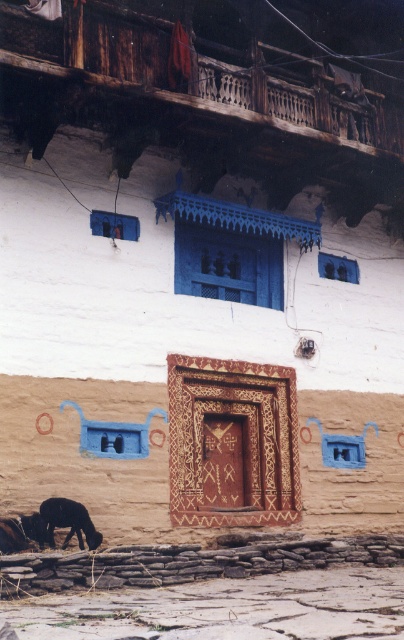
You are standing in front of the building and notice a wooden balcony at upper center and a black fur dog at lower left. Which object is positioned to the right of the other?

The wooden balcony at upper center is to the right of the black fur dog at lower left according to the description.

You are a visitor standing in front of the traditional building and see both the black fur goat at lower left and the black fur dog at lower left. Which animal is taller?

The black fur goat at lower left is much taller than the black fur dog at lower left.

You are a visitor standing near the black fur goat at lower left and want to reach the wooden balcony at upper center. Is the balcony taller than the goat?

The wooden balcony at upper center is not as tall as the black fur goat at lower left, so the balcony is shorter in height compared to the goat.